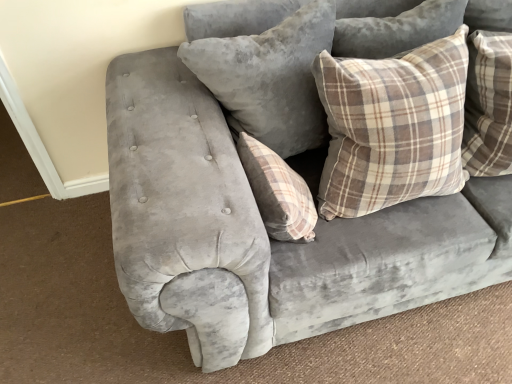
Question: Which direction should I rotate to look at plaid fabric pillow at center, the second pillow positioned from the left, — up or down?

Choices:
 (A) down
 (B) up

Answer: (B)

Question: Which direction should I rotate to face plush gray pillow at upper center, the first pillow when ordered from left to right, — up or down?

Choices:
 (A) down
 (B) up

Answer: (B)

Question: Is brown plaid pillow at upper right, the first pillow in the right-to-left sequence, at the back of plaid fabric pillow at center, which is the 2th pillow from right to left?

Choices:
 (A) yes
 (B) no

Answer: (B)

Question: From a real-world perspective, is plaid fabric pillow at center, which is the 2th pillow from right to left, on top of brown plaid pillow at upper right, the first pillow in the right-to-left sequence?

Choices:
 (A) yes
 (B) no

Answer: (B)

Question: Can you confirm if plaid fabric pillow at center, the second pillow positioned from the left, is positioned to the right of brown plaid pillow at upper right, which is the third pillow in left-to-right order?

Choices:
 (A) no
 (B) yes

Answer: (A)

Question: Is plaid fabric pillow at center, the second pillow positioned from the left, not inside brown plaid pillow at upper right, which is the third pillow in left-to-right order?

Choices:
 (A) no
 (B) yes

Answer: (B)

Question: Is plaid fabric pillow at center, the second pillow positioned from the left, to the left of brown plaid pillow at upper right, which is the third pillow in left-to-right order, from the viewer's perspective?

Choices:
 (A) yes
 (B) no

Answer: (A)

Question: Considering the relative sizes of plaid fabric pillow at center, the second pillow positioned from the left, and brown plaid pillow at upper right, the first pillow in the right-to-left sequence, in the image provided, is plaid fabric pillow at center, the second pillow positioned from the left, wider than brown plaid pillow at upper right, the first pillow in the right-to-left sequence,?

Choices:
 (A) yes
 (B) no

Answer: (B)

Question: Does brown plaid pillow at upper right, the first pillow in the right-to-left sequence, touch plush gray pillow at upper center, the first pillow when ordered from left to right?

Choices:
 (A) no
 (B) yes

Answer: (A)

Question: Is brown plaid pillow at upper right, which is the third pillow in left-to-right order, smaller than plush gray pillow at upper center, the first pillow when ordered from left to right?

Choices:
 (A) no
 (B) yes

Answer: (B)

Question: Can you confirm if brown plaid pillow at upper right, which is the third pillow in left-to-right order, is bigger than plush gray pillow at upper center, which appears as the 3th pillow when viewed from the right?

Choices:
 (A) no
 (B) yes

Answer: (A)

Question: From a real-world perspective, is brown plaid pillow at upper right, the first pillow in the right-to-left sequence, physically below plush gray pillow at upper center, the first pillow when ordered from left to right?

Choices:
 (A) yes
 (B) no

Answer: (A)

Question: Is brown plaid pillow at upper right, which is the third pillow in left-to-right order, far away from plush gray pillow at upper center, which appears as the 3th pillow when viewed from the right?

Choices:
 (A) yes
 (B) no

Answer: (B)

Question: Can you confirm if brown plaid pillow at upper right, the first pillow in the right-to-left sequence, is taller than plush gray pillow at upper center, which appears as the 3th pillow when viewed from the right?

Choices:
 (A) yes
 (B) no

Answer: (B)

Question: Is plush gray pillow at upper center, which appears as the 3th pillow when viewed from the right, facing away from brown plaid pillow at upper right, which is the third pillow in left-to-right order?

Choices:
 (A) yes
 (B) no

Answer: (B)